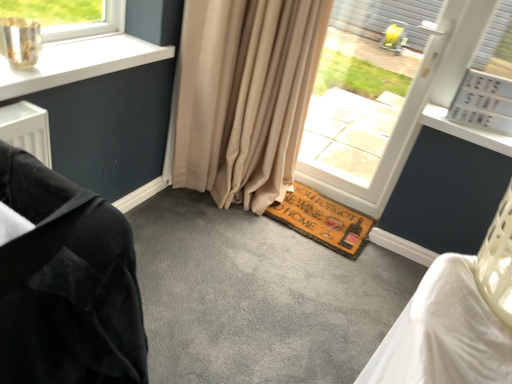
Question: Is the depth of white plastic window at center less than that of beige fabric curtain at center?

Choices:
 (A) no
 (B) yes

Answer: (A)

Question: From a real-world perspective, is white plastic window at center physically above beige fabric curtain at center?

Choices:
 (A) yes
 (B) no

Answer: (A)

Question: From the image's perspective, would you say white plastic window at center is shown under beige fabric curtain at center?

Choices:
 (A) no
 (B) yes

Answer: (A)

Question: From the image's perspective, is white plastic window at center over beige fabric curtain at center?

Choices:
 (A) no
 (B) yes

Answer: (B)

Question: Is white plastic window at center shorter than beige fabric curtain at center?

Choices:
 (A) yes
 (B) no

Answer: (B)

Question: Is white plastic window at center inside the boundaries of brown coir doormat at lower center, or outside?

Choices:
 (A) outside
 (B) inside

Answer: (A)

Question: From their relative heights in the image, would you say white plastic window at center is taller or shorter than brown coir doormat at lower center?

Choices:
 (A) short
 (B) tall

Answer: (B)

Question: Would you say white plastic window at center is to the left or to the right of brown coir doormat at lower center in the picture?

Choices:
 (A) right
 (B) left

Answer: (A)

Question: From a real-world perspective, is white plastic window at center physically located above or below brown coir doormat at lower center?

Choices:
 (A) below
 (B) above

Answer: (B)

Question: Is beige fabric curtain at center inside or outside of white plastic window at center?

Choices:
 (A) outside
 (B) inside

Answer: (A)

Question: Considering their positions, is beige fabric curtain at center located in front of or behind white plastic window at center?

Choices:
 (A) front
 (B) behind

Answer: (A)

Question: In terms of width, does beige fabric curtain at center look wider or thinner when compared to white plastic window at center?

Choices:
 (A) thin
 (B) wide

Answer: (B)

Question: Considering the positions of beige fabric curtain at center and white plastic window at center in the image, is beige fabric curtain at center bigger or smaller than white plastic window at center?

Choices:
 (A) small
 (B) big

Answer: (B)

Question: Considering their positions, is brown coir doormat at lower center located in front of or behind beige fabric curtain at center?

Choices:
 (A) front
 (B) behind

Answer: (B)

Question: From a real-world perspective, is brown coir doormat at lower center positioned above or below beige fabric curtain at center?

Choices:
 (A) above
 (B) below

Answer: (B)